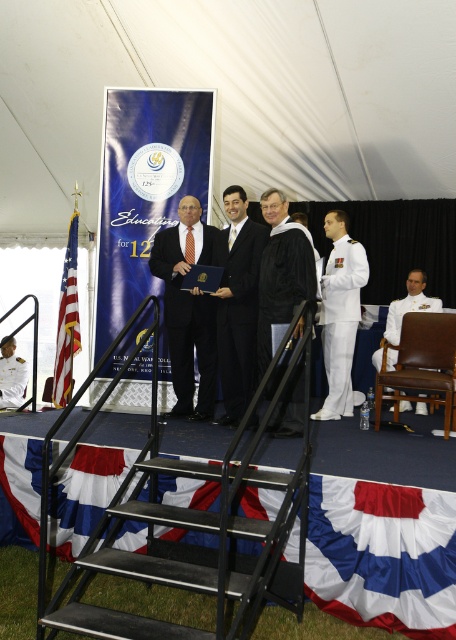
Is black matte graduation gown at center shorter than red fabric flag at left?

Yes.

Between black matte graduation gown at center and red fabric flag at left, which one appears on the left side from the viewer's perspective?

From the viewer's perspective, red fabric flag at left appears more on the left side.

This screenshot has height=640, width=456. What do you see at coordinates (281, 272) in the screenshot?
I see `black matte graduation gown at center` at bounding box center [281, 272].

This screenshot has width=456, height=640. In order to click on black matte graduation gown at center in this screenshot , I will do `click(281, 272)`.

Which is behind, point (72, 301) or point (9, 353)?

The point (9, 353) is more distant.

Between red fabric flag at left and white uniform at center, which one appears on the left side from the viewer's perspective?

white uniform at center is more to the left.

Is point (65, 385) closer to camera compared to point (25, 388)?

Yes, point (65, 385) is in front of point (25, 388).

This screenshot has height=640, width=456. I want to click on red fabric flag at left, so click(67, 321).

Based on the photo, does black metal stairs at lower center come behind white uniform at center?

No, it is not.

Describe the element at coordinates (188, 554) in the screenshot. I see `black metal stairs at lower center` at that location.

Between point (237, 592) and point (17, 369), which one is positioned in front?

Point (237, 592) is in front.

Locate an element on the screen. Image resolution: width=456 pixels, height=640 pixels. black metal stairs at lower center is located at coordinates (188, 554).